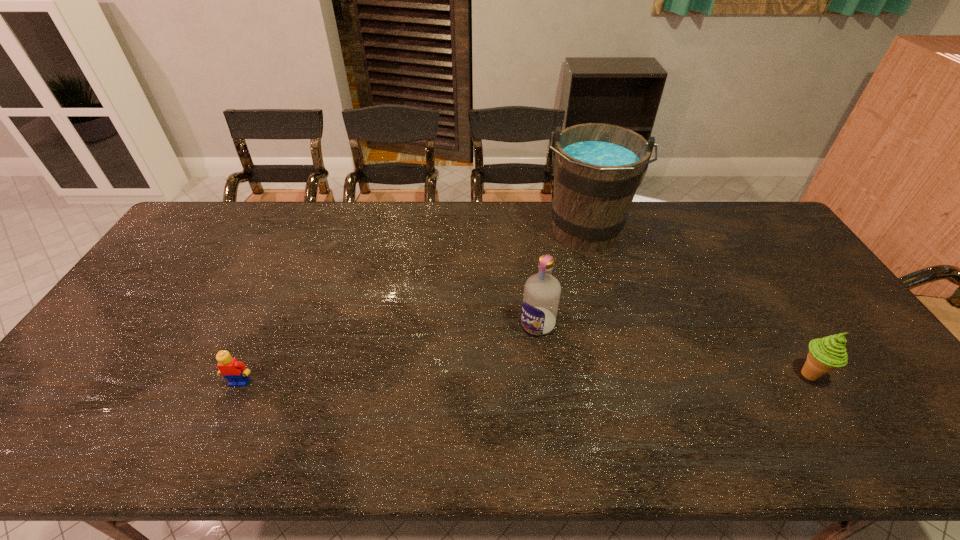
The image size is (960, 540). Find the location of `vacant space at the far edge`. vacant space at the far edge is located at coordinates (629, 221).

This screenshot has width=960, height=540. I want to click on vacant region at the near edge of the desktop, so click(x=375, y=409).

Where is `vacant space at the left edge of the desktop`? The width and height of the screenshot is (960, 540). vacant space at the left edge of the desktop is located at coordinates [x=182, y=268].

Locate an element on the screen. vacant space at the right edge of the desktop is located at coordinates (785, 277).

At what (x,y) coordinates should I click in order to perform the action: click on free region at the far left corner of the desktop. Please return your answer as a coordinate pair (x, y). Image resolution: width=960 pixels, height=540 pixels. Looking at the image, I should click on (184, 237).

Locate an element on the screen. Image resolution: width=960 pixels, height=540 pixels. vacant area that lies between the shortest object and the tallest object is located at coordinates (412, 308).

Locate an element on the screen. vacant area between the wine bucket and the icecream is located at coordinates (696, 305).

This screenshot has width=960, height=540. I want to click on vacant space that's between the rightmost object and the third nearest object, so click(x=673, y=349).

Image resolution: width=960 pixels, height=540 pixels. Find the location of `free space that is in between the leftmost object and the wine bucket`. free space that is in between the leftmost object and the wine bucket is located at coordinates (412, 308).

This screenshot has width=960, height=540. What are the coordinates of `free space between the tallest object and the leftmost object` in the screenshot? It's located at tap(412, 308).